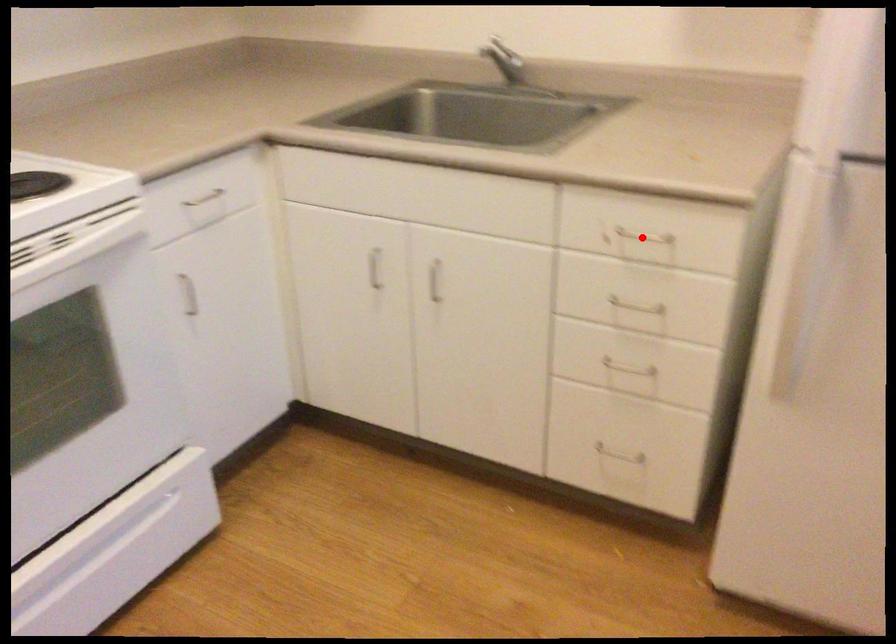
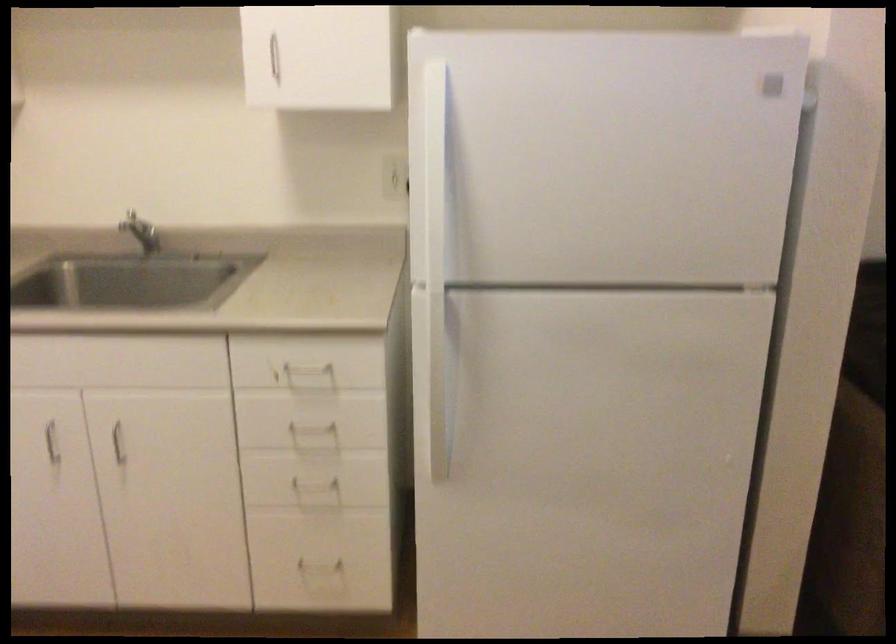
Find the pixel in the second image that matches the highlighted location in the first image.

(307, 368)